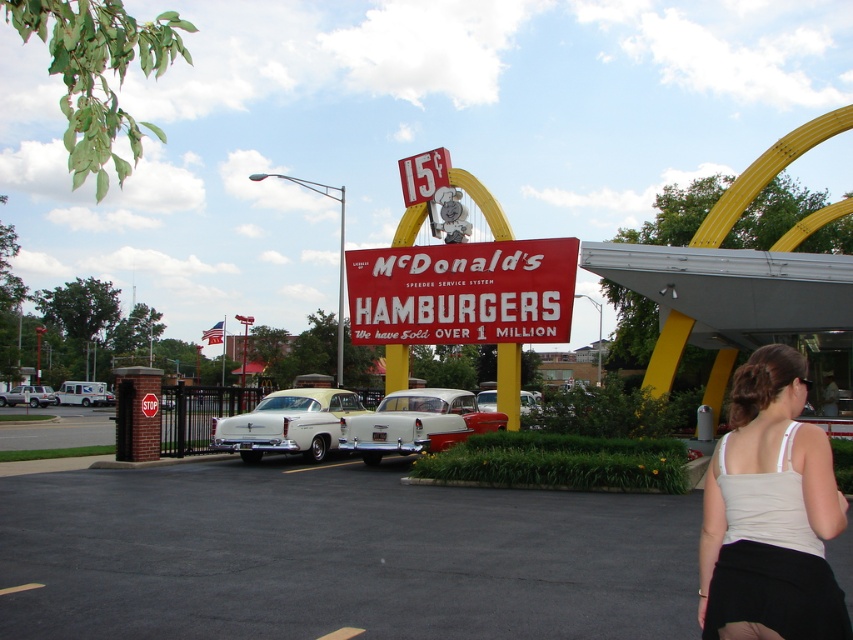
You are a photographer setting up a shot of the vintage McDonalds sign. You need to place a light beige tank top at lower right and a white matte van at left in the frame. Since the tank top is thinner than the van, which object should you position closer to the camera to ensure both fit within the frame?

Since the light beige tank top at lower right is thinner than the white matte van at left, you should position the light beige tank top at lower right closer to the camera to ensure both fit within the frame.

You are standing in front of the vintage McDonalds sign and notice two points marked in the scene. The first point is at coordinate point (540, 248) and the second is at point (289, 448). Which point is closer to you?

Point (540, 248) is further to the camera than point (289, 448), so the closer point to you is point (289, 448).

From the picture: You are a photographer trying to capture the vintage McDonalds sign. You have two vehicles in your frame, the yellow matte car at center and the white matte van at left. Which vehicle is closer to the sign?

The white matte van at left is closer to the sign because the yellow matte car at center is positioned on the right side of it, meaning the van is between the car and the sign.